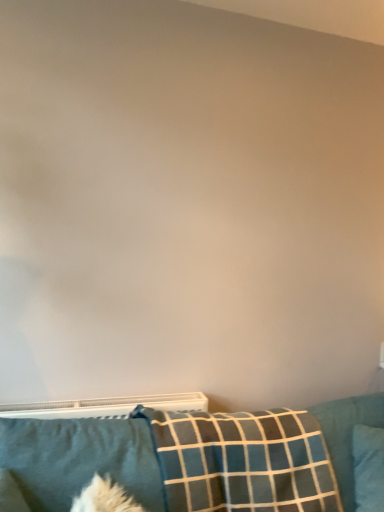
Question: Is plaid fabric pillow at lower center, acting as the second pillow starting from the right, to the left of blue fabric pillow at lower right, which appears as the third pillow when viewed from the left, from the viewer's perspective?

Choices:
 (A) no
 (B) yes

Answer: (B)

Question: Can you confirm if plaid fabric pillow at lower center, the second pillow positioned from the left, is bigger than blue fabric pillow at lower right, which is counted as the first pillow, starting from the right?

Choices:
 (A) yes
 (B) no

Answer: (A)

Question: Can you confirm if plaid fabric pillow at lower center, acting as the second pillow starting from the right, is smaller than blue fabric pillow at lower right, which is counted as the first pillow, starting from the right?

Choices:
 (A) no
 (B) yes

Answer: (A)

Question: Can you confirm if plaid fabric pillow at lower center, acting as the second pillow starting from the right, is shorter than blue fabric pillow at lower right, which is counted as the first pillow, starting from the right?

Choices:
 (A) no
 (B) yes

Answer: (A)

Question: Is plaid fabric pillow at lower center, the second pillow positioned from the left, taller than blue fabric pillow at lower right, which appears as the third pillow when viewed from the left?

Choices:
 (A) yes
 (B) no

Answer: (A)

Question: Is plaid fabric pillow at lower center, the second pillow positioned from the left, looking in the opposite direction of blue fabric pillow at lower right, which is counted as the first pillow, starting from the right?

Choices:
 (A) yes
 (B) no

Answer: (B)

Question: Is blue fabric pillow at lower right, which appears as the third pillow when viewed from the left, at the right side of soft blue fabric pillow at lower left, acting as the 3th pillow starting from the right?

Choices:
 (A) yes
 (B) no

Answer: (A)

Question: Does blue fabric pillow at lower right, which appears as the third pillow when viewed from the left, have a larger size compared to soft blue fabric pillow at lower left, which ranks as the first pillow in left-to-right order?

Choices:
 (A) yes
 (B) no

Answer: (B)

Question: Would you say blue fabric pillow at lower right, which appears as the third pillow when viewed from the left, contains soft blue fabric pillow at lower left, which ranks as the first pillow in left-to-right order?

Choices:
 (A) no
 (B) yes

Answer: (A)

Question: Does blue fabric pillow at lower right, which is counted as the first pillow, starting from the right, have a greater height compared to soft blue fabric pillow at lower left, acting as the 3th pillow starting from the right?

Choices:
 (A) yes
 (B) no

Answer: (A)

Question: Is there a large distance between blue fabric pillow at lower right, which is counted as the first pillow, starting from the right, and soft blue fabric pillow at lower left, which ranks as the first pillow in left-to-right order?

Choices:
 (A) yes
 (B) no

Answer: (B)

Question: Is blue fabric pillow at lower right, which is counted as the first pillow, starting from the right, positioned beyond the bounds of soft blue fabric pillow at lower left, which ranks as the first pillow in left-to-right order?

Choices:
 (A) no
 (B) yes

Answer: (B)

Question: Can you confirm if soft blue fabric pillow at lower left, acting as the 3th pillow starting from the right, is bigger than teal fabric couch at lower center?

Choices:
 (A) yes
 (B) no

Answer: (B)